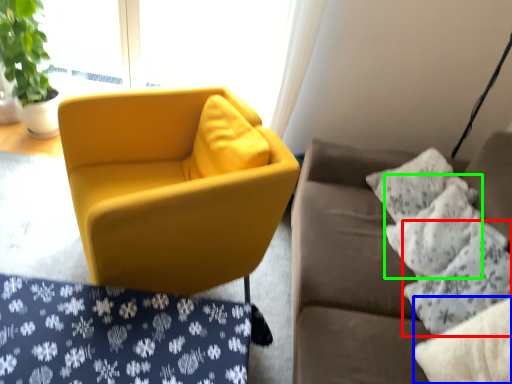
Question: Estimate the real-world distances between objects in this image. Which object is closer to pillow (highlighted by a red box), pillow (highlighted by a blue box) or pillow (highlighted by a green box)?

Choices:
 (A) pillow
 (B) pillow

Answer: (B)